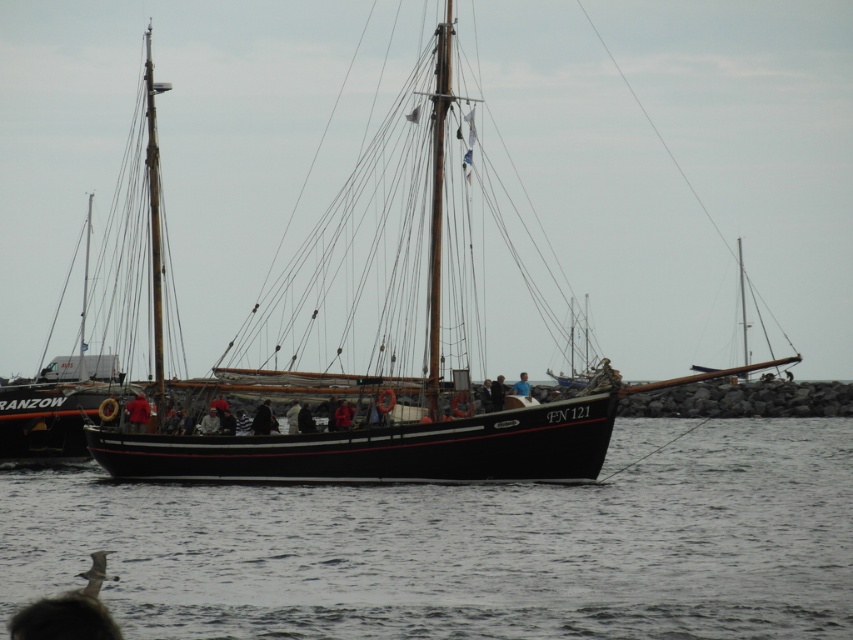
Is point (741, 301) positioned before point (502, 376)?

That is False.

Can you confirm if wooden mast at right is positioned below dark blue fabric jacket at center?

Incorrect, wooden mast at right is not positioned below dark blue fabric jacket at center.

Locate an element on the screen. The image size is (853, 640). wooden mast at right is located at coordinates (741, 308).

Can you confirm if black water at center is shorter than blue fabric at center?

No, black water at center is not shorter than blue fabric at center.

Which is behind, point (184, 563) or point (514, 387)?

The point (514, 387) is behind.

I want to click on black water at center, so click(x=465, y=548).

The width and height of the screenshot is (853, 640). What are the coordinates of `black polished wood sailboat at center` in the screenshot? It's located at (393, 445).

Who is taller, black polished wood sailboat at center or red fabric jacket at center?

With more height is black polished wood sailboat at center.

Who is more distant from viewer, (357, 481) or (132, 404)?

The point (132, 404) is more distant.

The width and height of the screenshot is (853, 640). What are the coordinates of `black polished wood sailboat at center` in the screenshot? It's located at (393, 445).